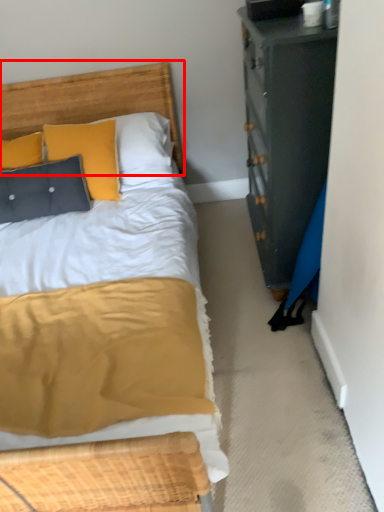
Question: Where is headboard (annotated by the red box) located in relation to pillow in the image?

Choices:
 (A) right
 (B) left

Answer: (A)